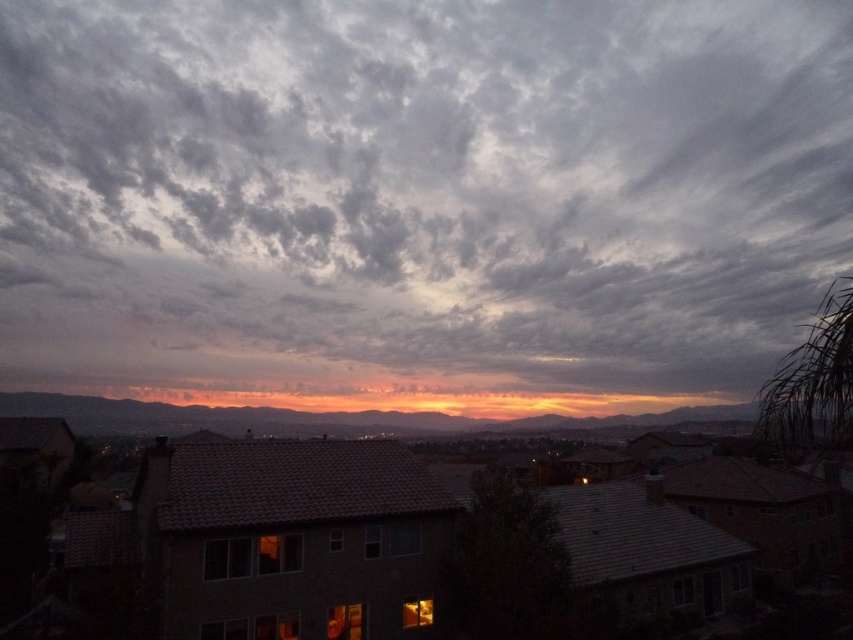
Is cloudy sky at upper center smaller than orange sky at center?

Incorrect, cloudy sky at upper center is not smaller in size than orange sky at center.

Measure the distance from cloudy sky at upper center to orange sky at center.

cloudy sky at upper center and orange sky at center are 209.65 feet apart.

At what (x,y) coordinates should I click in order to perform the action: click on cloudy sky at upper center. Please return your answer as a coordinate pair (x, y). This screenshot has width=853, height=640. Looking at the image, I should click on (418, 196).

Locate an element on the screen. This screenshot has width=853, height=640. cloudy sky at upper center is located at coordinates (418, 196).